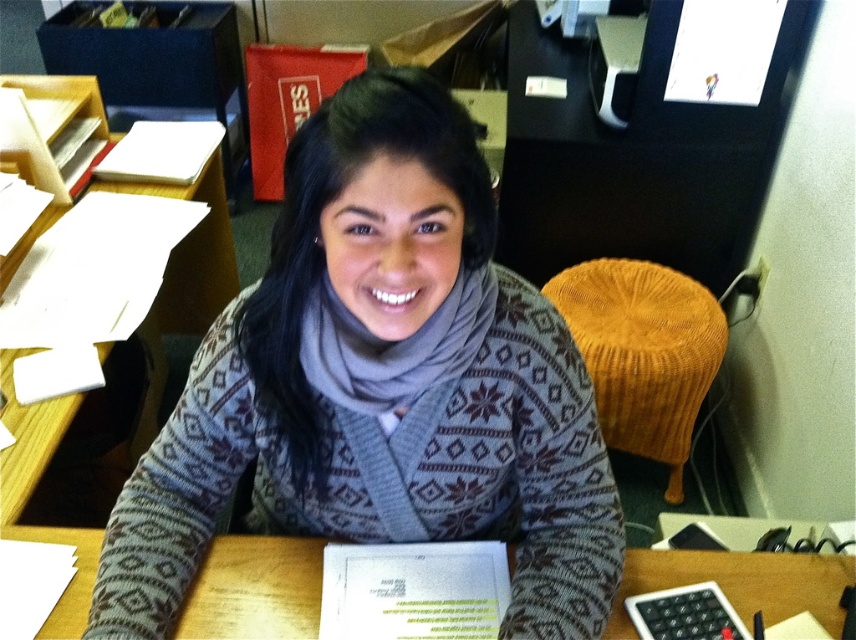
You are organizing a photo shoot and need to place a small prop between the gray knitted sweater at center and the orange knitted stool at right. Based on their positions, which object should the prop be closer to?

The gray knitted sweater at center is positioned on the left side of the orange knitted stool at right, so the prop should be placed closer to the orange knitted stool at right since it is on the right side of the sweater.

You are organizing a photo shoot and need to ensure that the gray knitted sweater at center and the orange knitted stool at right are both visible in the frame. Based on their positions, which object should you focus on first to ensure both are in focus?

The gray knitted sweater at center should be focused on first since it is closer to the viewer than the orange knitted stool at right. By focusing on the closer object, the stool will also be in focus due to depth of field.

You are organizing an office space and need to move a file from the wooden table at center to the orange knitted stool at right. Based on their positions, can you place the file directly on top of the stool without moving any other objects?

The wooden table at center is to the left of orange knitted stool at right, so yes, you can place the file directly on top of the orange knitted stool at right since there is no obstruction between them.